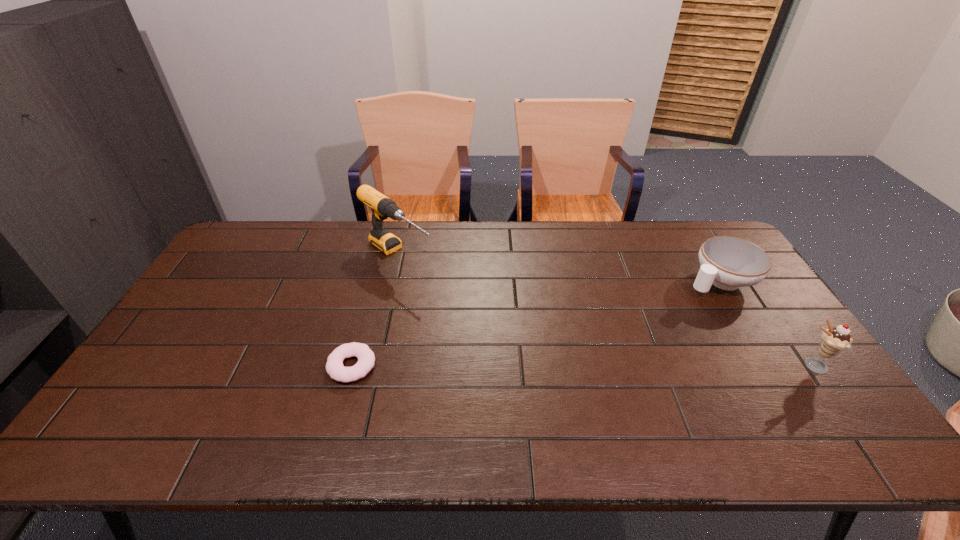
Where is `the shortest object`? the shortest object is located at coordinates (334, 366).

The height and width of the screenshot is (540, 960). In order to click on icecream in this screenshot , I will do `click(834, 340)`.

This screenshot has width=960, height=540. In order to click on the third tallest object in this screenshot , I will do `click(728, 263)`.

Locate an element on the screen. the tallest object is located at coordinates (382, 207).

This screenshot has height=540, width=960. I want to click on free region located 0.080m on the left of the doughnut, so click(298, 366).

I want to click on vacant region located on the back of the second tallest object, so click(766, 301).

Where is `blank space located 0.130m on the side with the handle of the third tallest object`? The image size is (960, 540). blank space located 0.130m on the side with the handle of the third tallest object is located at coordinates (665, 308).

This screenshot has height=540, width=960. What are the coordinates of `vacant space located on the side with the handle of the third tallest object` in the screenshot? It's located at (637, 323).

Where is `free space located 0.070m on the side with the handle of the third tallest object`? The image size is (960, 540). free space located 0.070m on the side with the handle of the third tallest object is located at coordinates (679, 300).

Where is `vacant area situated 0.110m on the handle side of the tallest object`? The image size is (960, 540). vacant area situated 0.110m on the handle side of the tallest object is located at coordinates (444, 288).